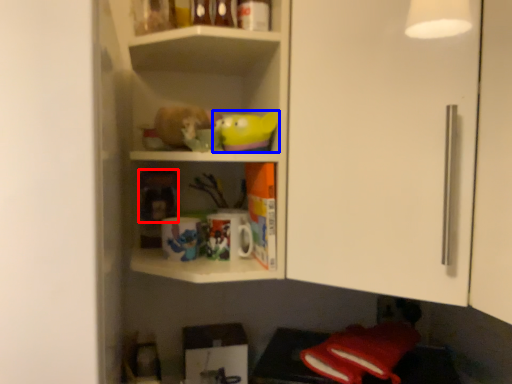
Question: Among these objects, which one is nearest to the camera, toy (highlighted by a red box) or toy (highlighted by a blue box)?

Choices:
 (A) toy
 (B) toy

Answer: (B)